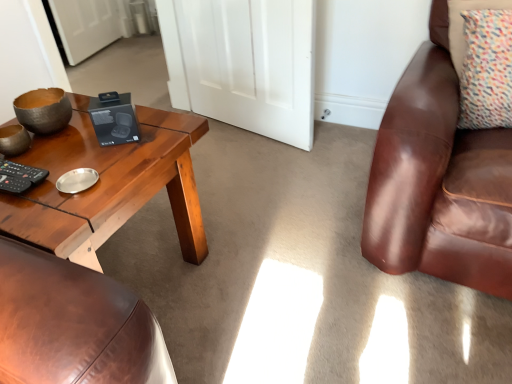
The width and height of the screenshot is (512, 384). I want to click on vacant space in white matte door at center (from a real-world perspective), so click(247, 142).